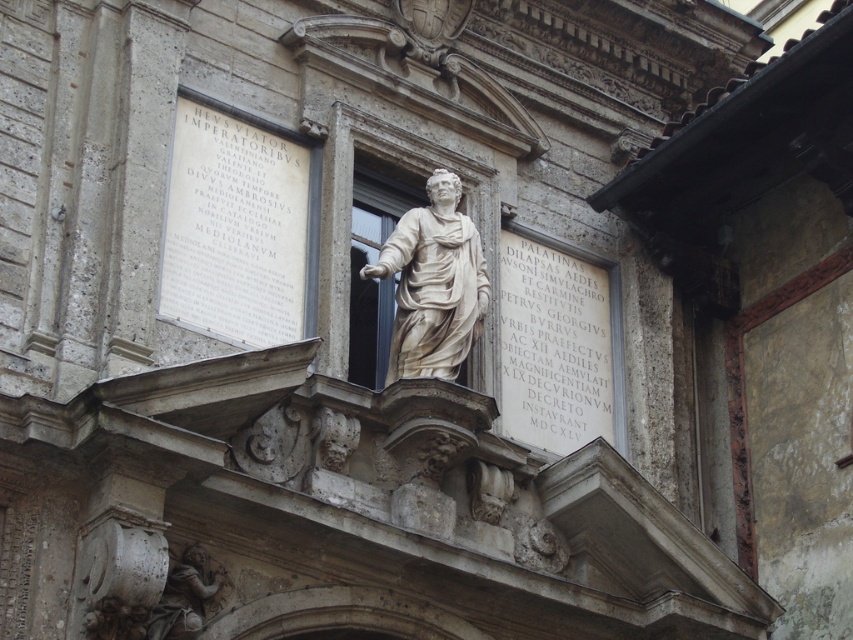
In the scene shown: Can you confirm if white stone plaque at center is positioned above white marble cherub at lower left?

Correct, white stone plaque at center is located above white marble cherub at lower left.

Can you confirm if white stone plaque at center is positioned to the right of white marble cherub at lower left?

Indeed, white stone plaque at center is positioned on the right side of white marble cherub at lower left.

The width and height of the screenshot is (853, 640). What do you see at coordinates (553, 348) in the screenshot?
I see `white stone plaque at center` at bounding box center [553, 348].

The width and height of the screenshot is (853, 640). Identify the location of white stone plaque at center. (553, 348).

Is point (444, 273) behind point (225, 582)?

Yes, point (444, 273) is farther from viewer.

Is point (412, 209) in front of point (194, 602)?

That is False.

What do you see at coordinates (433, 284) in the screenshot?
I see `light beige marble statue at center` at bounding box center [433, 284].

Identify the location of light beige marble statue at center. (433, 284).

Is point (184, 141) positioned behind point (186, 632)?

Yes, point (184, 141) is behind point (186, 632).

Does white stone plaque at upper left have a lesser width compared to white marble cherub at lower left?

Yes, white stone plaque at upper left is thinner than white marble cherub at lower left.

The height and width of the screenshot is (640, 853). I want to click on white stone plaque at upper left, so click(236, 227).